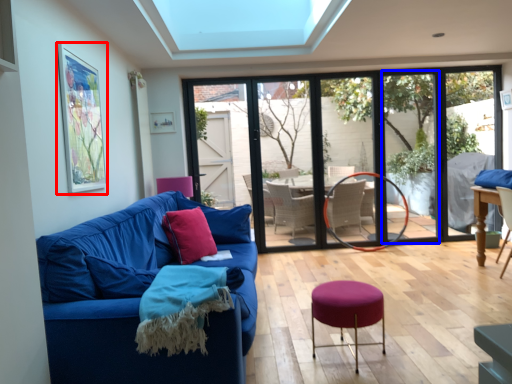
Question: Which point is further to the camera, picture frame (highlighted by a red box) or window screen (highlighted by a blue box)?

Choices:
 (A) picture frame
 (B) window screen

Answer: (B)